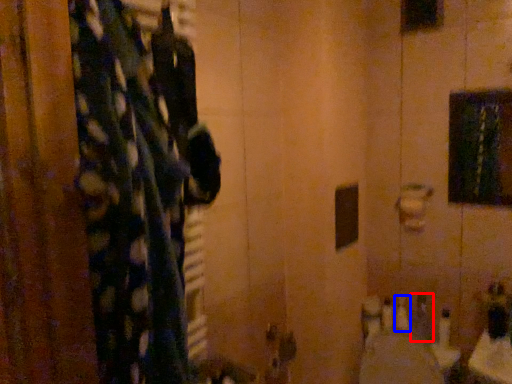
Question: Which object appears farthest to the camera in this image, toiletry (highlighted by a red box) or toiletry (highlighted by a blue box)?

Choices:
 (A) toiletry
 (B) toiletry

Answer: (B)